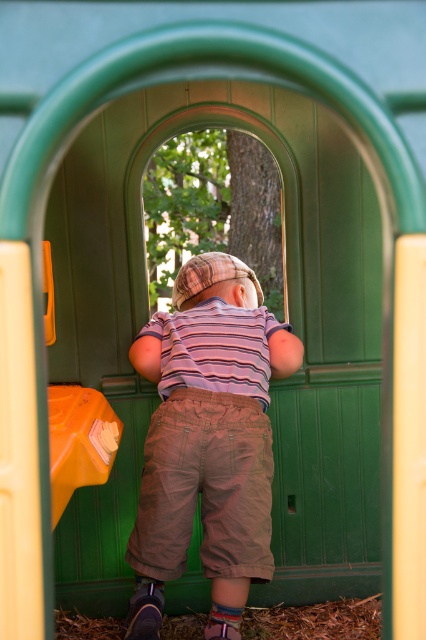
Question: Does green matte door at center appear on the left side of orange plastic slide at left?

Choices:
 (A) yes
 (B) no

Answer: (B)

Question: Among these points, which one is nearest to the camera?

Choices:
 (A) (316, 262)
 (B) (75, 410)

Answer: (B)

Question: Is green matte door at center above orange plastic slide at left?

Choices:
 (A) yes
 (B) no

Answer: (A)

Question: Estimate the real-world distances between objects in this image. Which object is closer to the striped cotton shirt at center?

Choices:
 (A) green matte door at center
 (B) orange plastic slide at left

Answer: (B)

Question: Which point is farther from the camera taking this photo?

Choices:
 (A) (241, 300)
 (B) (85, 424)

Answer: (A)

Question: Is the position of green matte door at center more distant than that of orange plastic slide at left?

Choices:
 (A) no
 (B) yes

Answer: (B)